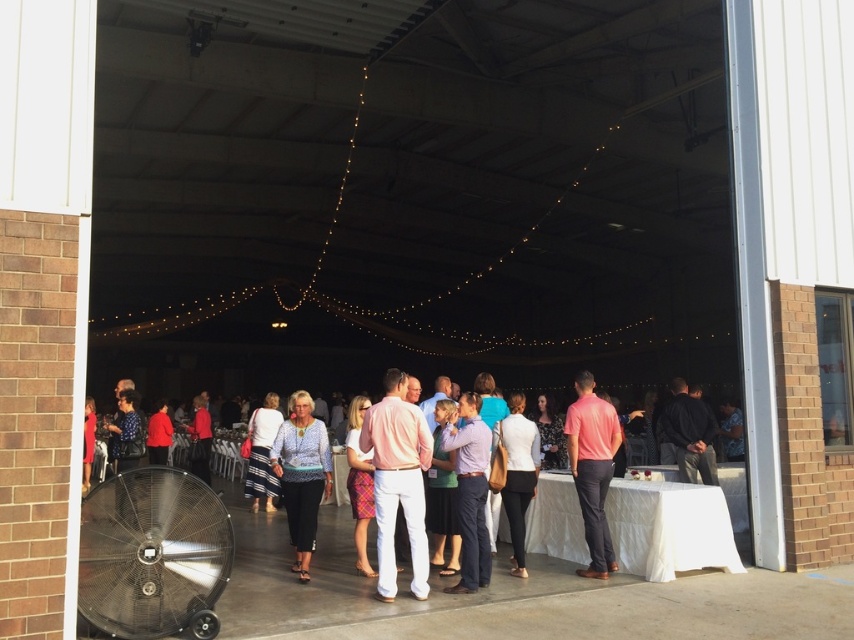
Who is more forward, (664, 468) or (399, 476)?

Point (399, 476)

Is white cloth-covered table at lower right above pink cotton shirt at center?

Yes, white cloth-covered table at lower right is above pink cotton shirt at center.

Is point (623, 509) more distant than point (376, 518)?

Yes, point (623, 509) is behind point (376, 518).

You are a GUI agent. You are given a task and a screenshot of the screen. Output one action in this format:
    pyautogui.click(x=<x>, y=<y>)
    Task: Click on the white cloth-covered table at lower right
    The width and height of the screenshot is (854, 640).
    Given the screenshot: What is the action you would take?
    pyautogui.click(x=676, y=522)

Is point (623, 502) more distant than point (307, 508)?

Yes, it is behind point (307, 508).

Which is more to the right, white cloth-covered table at lower right or patterned fabric blouse at center?

white cloth-covered table at lower right

Which is behind, point (729, 557) or point (305, 403)?

Positioned behind is point (305, 403).

This screenshot has width=854, height=640. In order to click on white cloth-covered table at lower right in this screenshot , I will do coord(676,522).

Does pink cotton shirt at center appear under white matte blazer at center?

Yes.

Can you confirm if pink cotton shirt at center is taller than white matte blazer at center?

In fact, pink cotton shirt at center may be shorter than white matte blazer at center.

Is point (366, 417) closer to viewer compared to point (518, 424)?

Yes, it is.

This screenshot has width=854, height=640. Find the location of `pink cotton shirt at center`. pink cotton shirt at center is located at coordinates (398, 481).